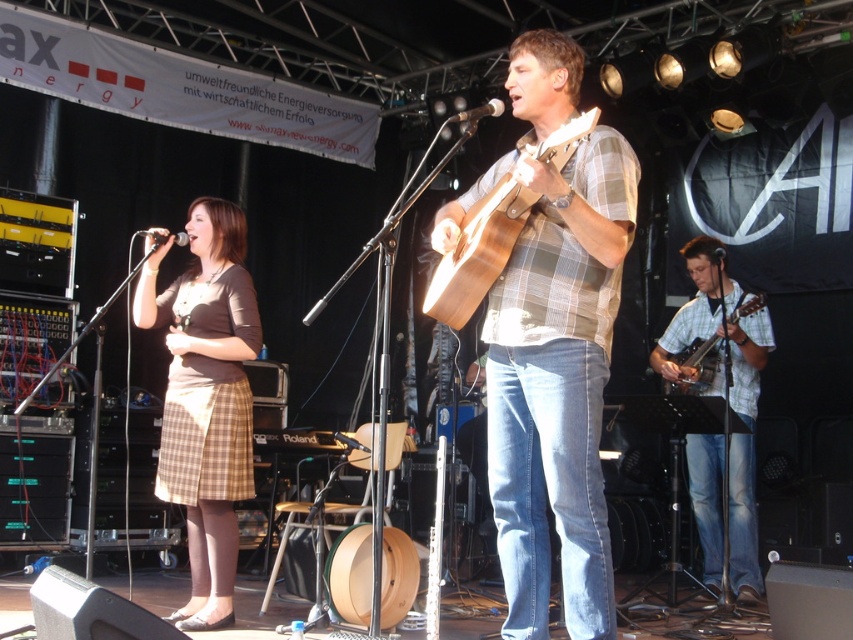
In the scene shown: You are a stagehand who needs to adjust the height of the microphone stand for the performer wearing the brown plaid skirt at left. Based on the scene, is the metallic silver microphone at center currently positioned at a height that is too low, too high, or just right for the performer?

The brown plaid skirt at left is much taller than the metallic silver microphone at center, so the microphone is positioned too low for the performer.